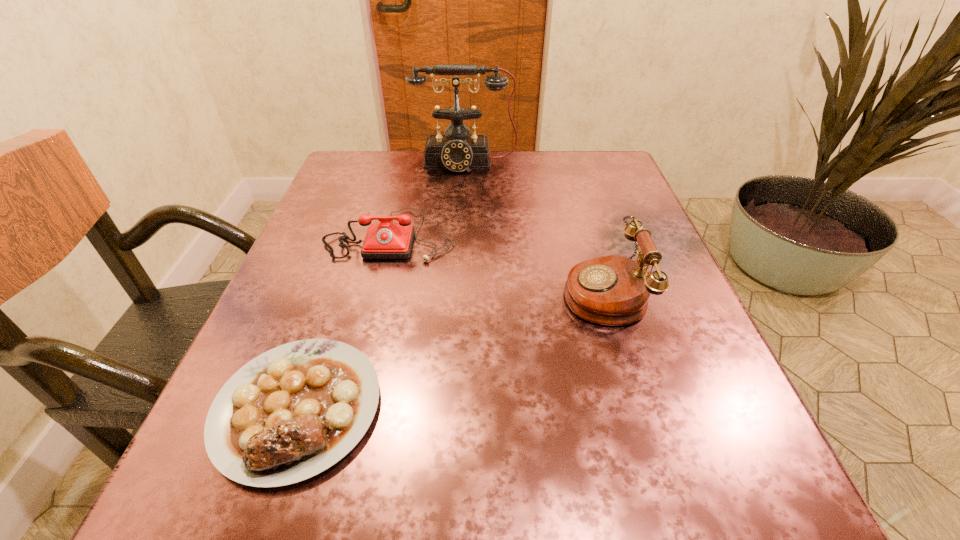
Where is `vacant space located on the dial of the rightmost object`? vacant space located on the dial of the rightmost object is located at coordinates (487, 291).

Identify the location of vacant space positioned on the dial of the third tallest object. (340, 436).

Where is `object that is at the far edge`? The width and height of the screenshot is (960, 540). object that is at the far edge is located at coordinates (457, 150).

Locate an element on the screen. The height and width of the screenshot is (540, 960). object that is at the near edge is located at coordinates (294, 411).

The width and height of the screenshot is (960, 540). Identify the location of telephone that is at the left edge. (386, 240).

This screenshot has width=960, height=540. I want to click on steak that is at the left edge, so click(294, 411).

The image size is (960, 540). Find the location of `object present at the right edge`. object present at the right edge is located at coordinates (614, 290).

At what (x,y) coordinates should I click in order to perform the action: click on object located in the near left corner section of the desktop. Please return your answer as a coordinate pair (x, y). Looking at the image, I should click on (294, 411).

The width and height of the screenshot is (960, 540). I want to click on free space at the far edge, so pyautogui.click(x=444, y=172).

What are the coordinates of `vacant area at the near edge of the desktop` in the screenshot? It's located at (414, 477).